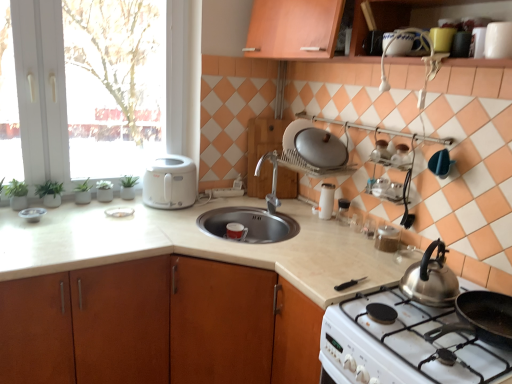
Locate an element on the screen. This screenshot has width=512, height=384. vacant region to the left of white glossy plate at left, the 3th appliance viewed from the top is located at coordinates (82, 208).